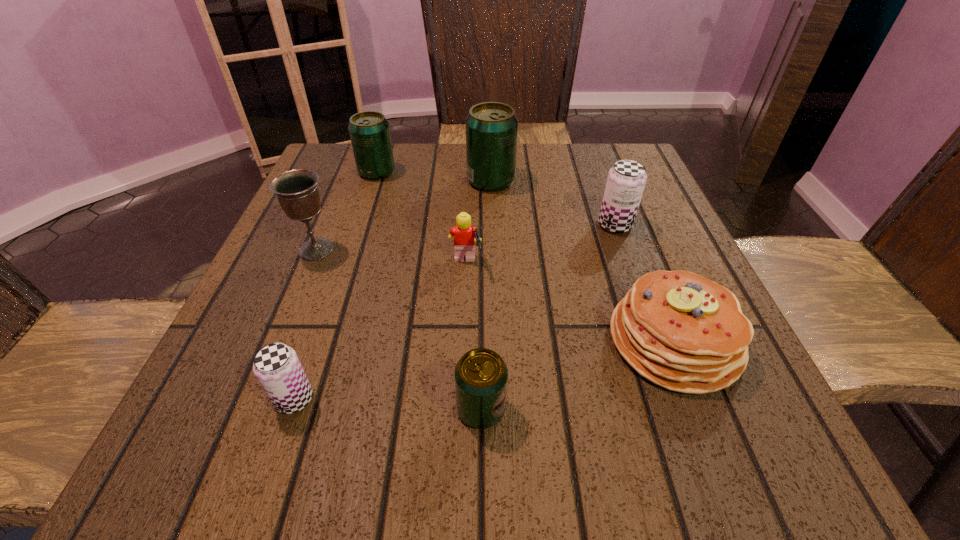
Where is `free space between the nearest green beer can and the left purple beer can`? The image size is (960, 540). free space between the nearest green beer can and the left purple beer can is located at coordinates (388, 404).

Locate an element on the screen. vacant space in between the nearer purple beer can and the biggest green beer can is located at coordinates (393, 290).

Where is `vacant area between the pancake and the bronze chalice`? Image resolution: width=960 pixels, height=540 pixels. vacant area between the pancake and the bronze chalice is located at coordinates (495, 295).

You are a GUI agent. You are given a task and a screenshot of the screen. Output one action in this format:
    pyautogui.click(x=<x>, y=<y>)
    Task: Click on the vacant point located between the tallest beer can and the second smallest green beer can
    The width and height of the screenshot is (960, 540).
    Given the screenshot: What is the action you would take?
    pyautogui.click(x=434, y=176)

Where is `free space between the Lego and the chalice`? This screenshot has width=960, height=540. free space between the Lego and the chalice is located at coordinates (391, 257).

Where is `empty space that is in between the left purple beer can and the nearest green beer can`? The height and width of the screenshot is (540, 960). empty space that is in between the left purple beer can and the nearest green beer can is located at coordinates (388, 404).

At what (x,y) coordinates should I click in order to perform the action: click on free space between the pancake and the second biggest green beer can. Please return your answer as a coordinate pair (x, y). Looking at the image, I should click on (525, 256).

Locate an element on the screen. This screenshot has height=540, width=960. free space between the Lego and the smallest green beer can is located at coordinates (473, 337).

I want to click on object that is the closest to the smallest green beer can, so click(x=681, y=331).

This screenshot has height=540, width=960. I want to click on the fourth closest object to the nearer purple beer can, so click(681, 331).